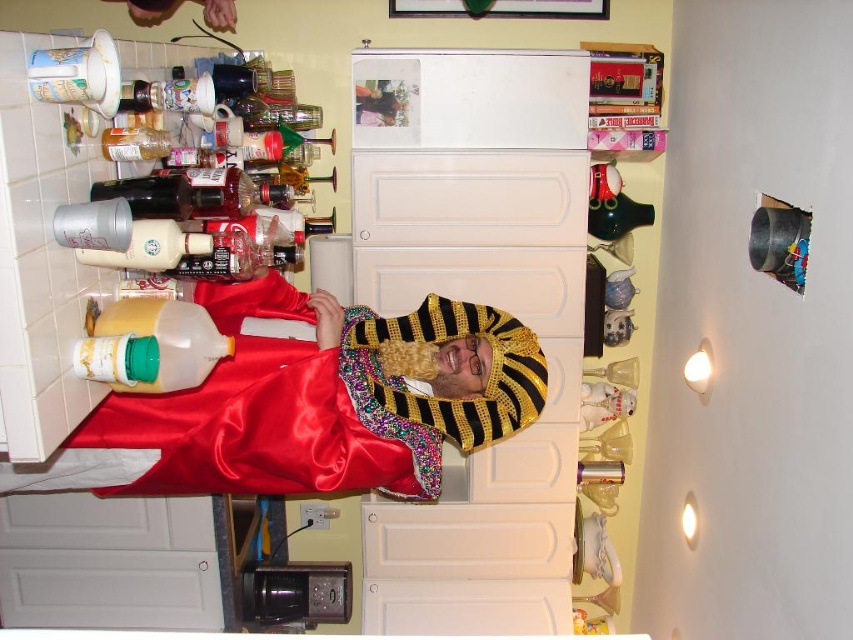
Question: Can you confirm if satin gold headdress at center is positioned to the right of yellow translucent jug at left?

Choices:
 (A) no
 (B) yes

Answer: (B)

Question: Which object appears closest to the camera in this image?

Choices:
 (A) yellow translucent jug at left
 (B) satin gold headdress at center

Answer: (A)

Question: Does satin gold headdress at center appear on the right side of yellow translucent jug at left?

Choices:
 (A) yes
 (B) no

Answer: (A)

Question: Among these objects, which one is nearest to the camera?

Choices:
 (A) yellow translucent jug at left
 (B) satin gold headdress at center

Answer: (A)

Question: Is satin gold headdress at center bigger than yellow translucent jug at left?

Choices:
 (A) yes
 (B) no

Answer: (A)